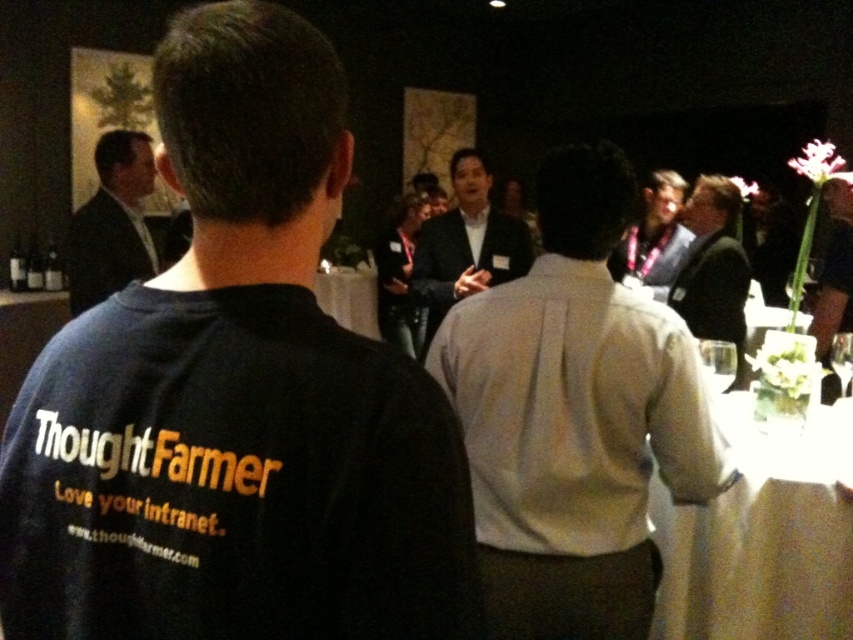
Which is more to the left, dark gray suit at center or clear glass wine glass at center?

dark gray suit at center

How distant is dark gray suit at center from clear glass wine glass at center?

The distance of dark gray suit at center from clear glass wine glass at center is 3.70 feet.

Between point (532, 260) and point (727, 365), which one is positioned behind?

The point (532, 260) is more distant.

You are a GUI agent. You are given a task and a screenshot of the screen. Output one action in this format:
    pyautogui.click(x=<x>, y=<y>)
    Task: Click on the dark gray suit at center
    
    Given the screenshot: What is the action you would take?
    pyautogui.click(x=466, y=244)

Which is more to the right, black cotton shirt at center or transparent glass at upper right?

From the viewer's perspective, transparent glass at upper right appears more on the right side.

Which is in front, point (228, 32) or point (848, 355)?

Point (228, 32) is in front.

I want to click on black cotton shirt at center, so click(x=236, y=397).

Does black cotton shirt at center come in front of dark suit at right?

Yes, it is.

Describe the element at coordinates (236, 397) in the screenshot. This screenshot has height=640, width=853. I see `black cotton shirt at center` at that location.

Is point (291, 280) closer to camera compared to point (704, 273)?

Yes, point (291, 280) is in front of point (704, 273).

This screenshot has width=853, height=640. In order to click on black cotton shirt at center in this screenshot , I will do `click(236, 397)`.